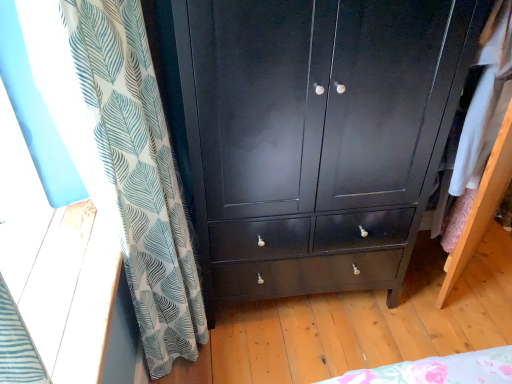
Question: From the image's perspective, is glossy black cabinet at center positioned above or below white leaf-patterned curtain at left?

Choices:
 (A) below
 (B) above

Answer: (B)

Question: Is glossy black cabinet at center bigger or smaller than white leaf-patterned curtain at left?

Choices:
 (A) small
 (B) big

Answer: (B)

Question: From a real-world perspective, is glossy black cabinet at center above or below white leaf-patterned curtain at left?

Choices:
 (A) below
 (B) above

Answer: (A)

Question: In terms of size, does white leaf-patterned curtain at left appear bigger or smaller than glossy black cabinet at center?

Choices:
 (A) small
 (B) big

Answer: (A)

Question: Visually, is white leaf-patterned curtain at left positioned to the left or to the right of glossy black cabinet at center?

Choices:
 (A) right
 (B) left

Answer: (B)

Question: From the image's perspective, relative to glossy black cabinet at center, is white leaf-patterned curtain at left above or below?

Choices:
 (A) above
 (B) below

Answer: (B)

Question: Does point (119, 201) appear closer or farther from the camera than point (388, 28)?

Choices:
 (A) farther
 (B) closer

Answer: (B)